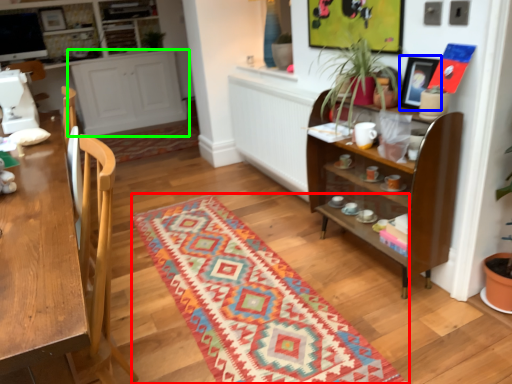
Question: Considering the real-world distances, which object is closest to mat (highlighted by a red box)? picture frame (highlighted by a blue box) or cabinetry (highlighted by a green box).

Choices:
 (A) picture frame
 (B) cabinetry

Answer: (A)